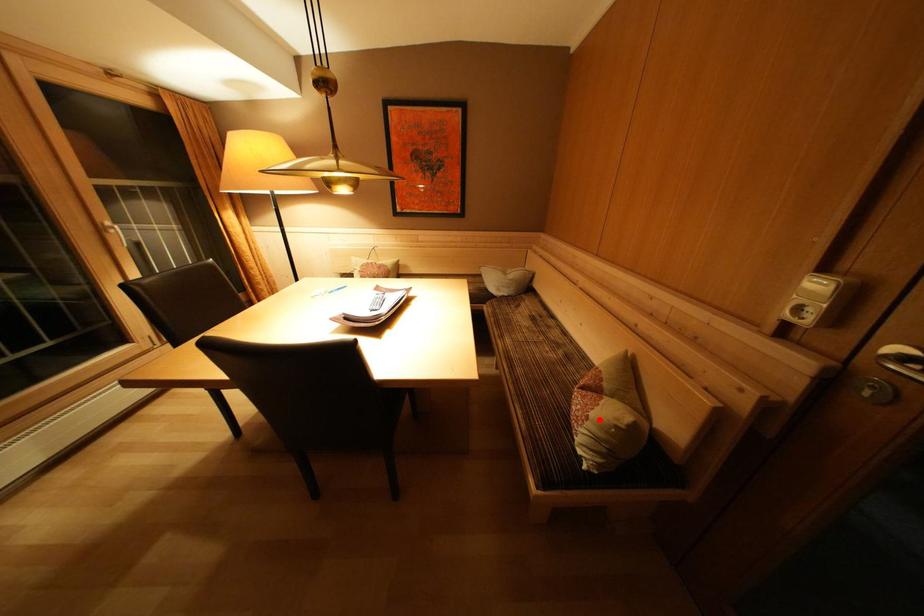
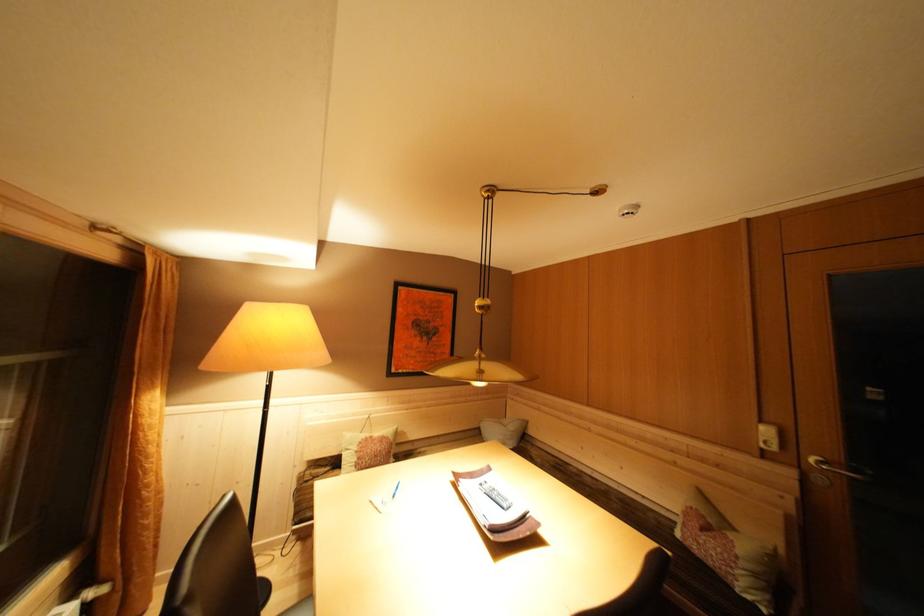
The point at the highlighted location is marked in the first image. Where is the corresponding point in the second image?

(746, 557)